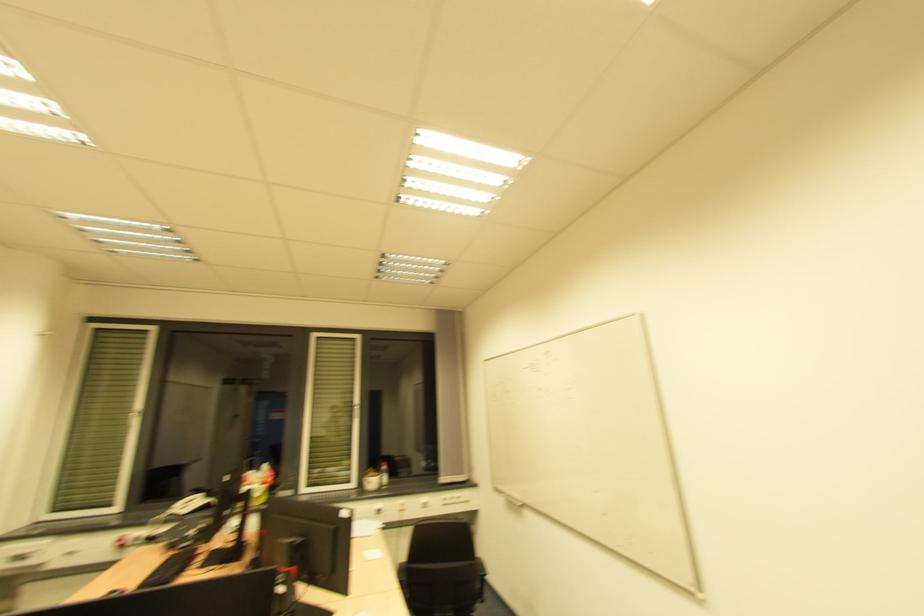
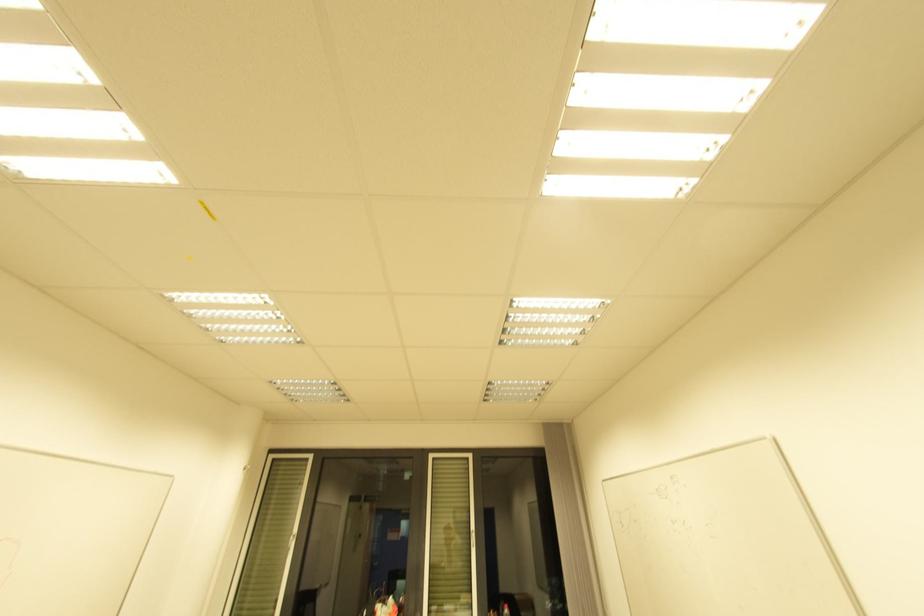
First-person continuous shooting, in which direction is the camera rotating?

The camera rotated toward left-up.